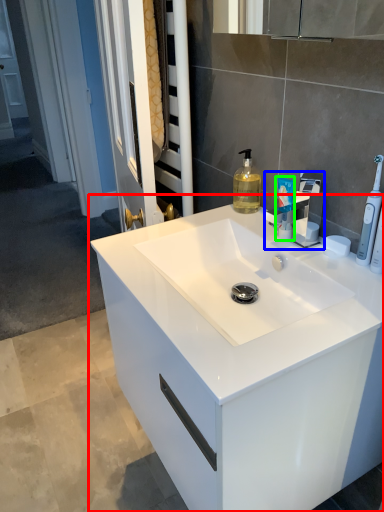
Question: Based on their relative distances, which object is nearer to bathroom cabinet (highlighted by a red box)? Choose from tap (highlighted by a blue box) and toiletry (highlighted by a green box).

Choices:
 (A) tap
 (B) toiletry

Answer: (A)